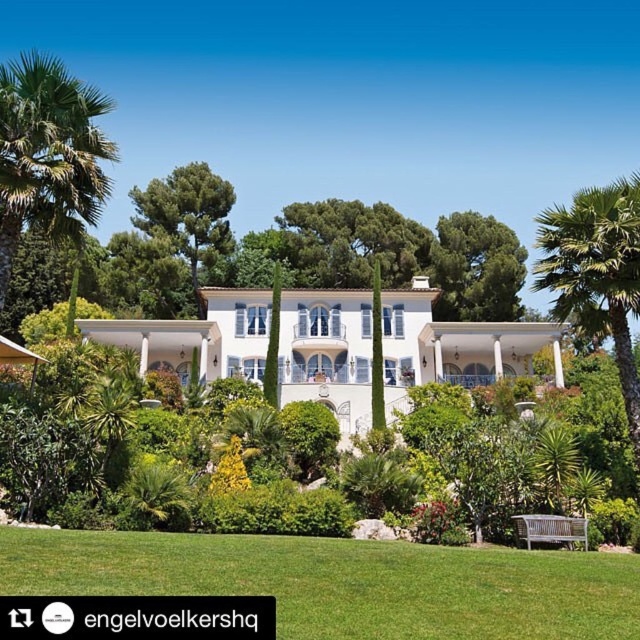
Is green grass at center taller than green leafy tree at upper center?

In fact, green grass at center may be shorter than green leafy tree at upper center.

This screenshot has height=640, width=640. What are the coordinates of `green grass at center` in the screenshot? It's located at (344, 582).

Consider the image. Which is above, green grass at center or white glossy mansion at center?

white glossy mansion at center is above.

Between green grass at center and white glossy mansion at center, which one is positioned lower?

green grass at center is below.

Describe the element at coordinates (344, 582) in the screenshot. I see `green grass at center` at that location.

Locate an element on the screen. green grass at center is located at coordinates (344, 582).

Who is lower down, green leafy palm tree at left or green leafy tree at upper center?

green leafy tree at upper center is below.

Which is in front, point (54, 97) or point (504, 296)?

Point (54, 97) is more forward.

Locate an element on the screen. This screenshot has height=640, width=640. green leafy palm tree at left is located at coordinates (48, 156).